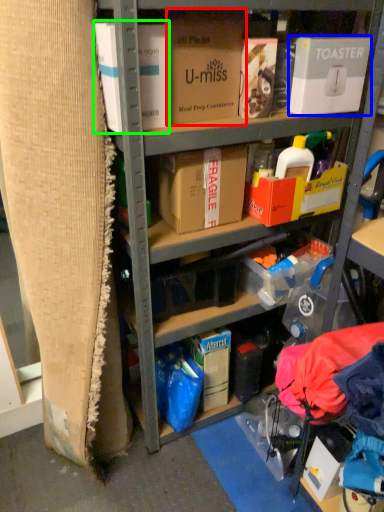
Question: Considering the real-world distances, which object is closest to box (highlighted by a red box)? box (highlighted by a blue box) or box (highlighted by a green box).

Choices:
 (A) box
 (B) box

Answer: (B)